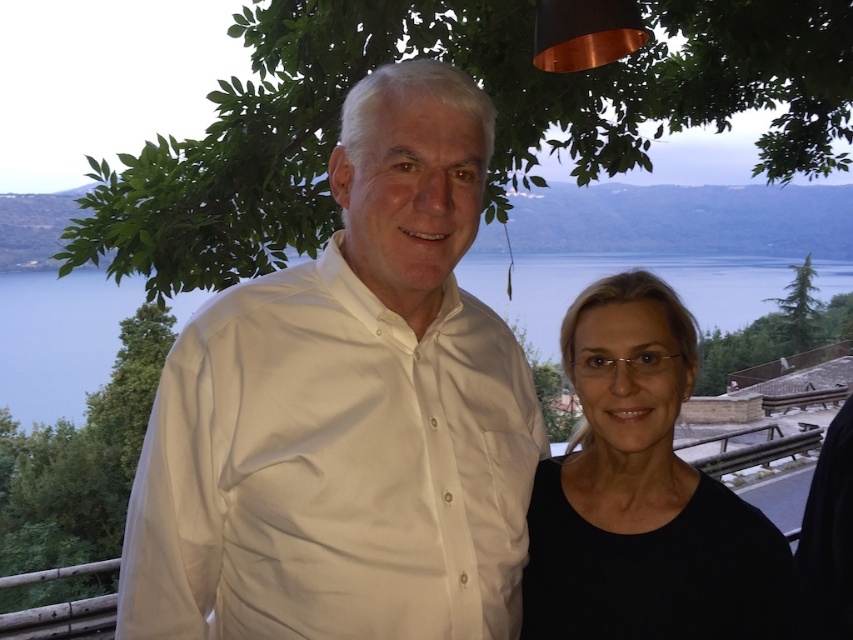
Question: Which point appears farthest from the camera in this image?

Choices:
 (A) (376, 260)
 (B) (144, 321)

Answer: (B)

Question: Considering the relative positions of transparent water at center and green textured tree at upper right in the image provided, where is transparent water at center located with respect to green textured tree at upper right?

Choices:
 (A) left
 (B) right

Answer: (A)

Question: Estimate the real-world distances between objects in this image. Which object is closer to the white smooth shirt at center?

Choices:
 (A) green leafy tree at upper center
 (B) transparent water at center
 (C) green leafy tree at left

Answer: (B)

Question: Estimate the real-world distances between objects in this image. Which object is closer to the black matte shirt at right?

Choices:
 (A) white smooth shirt at center
 (B) green leafy tree at upper center
 (C) green textured tree at upper right
 (D) green leafy tree at left

Answer: (A)

Question: Is green leafy tree at left below green textured tree at upper right?

Choices:
 (A) no
 (B) yes

Answer: (B)

Question: Can you confirm if green leafy tree at left is positioned to the left of green textured tree at upper right?

Choices:
 (A) yes
 (B) no

Answer: (A)